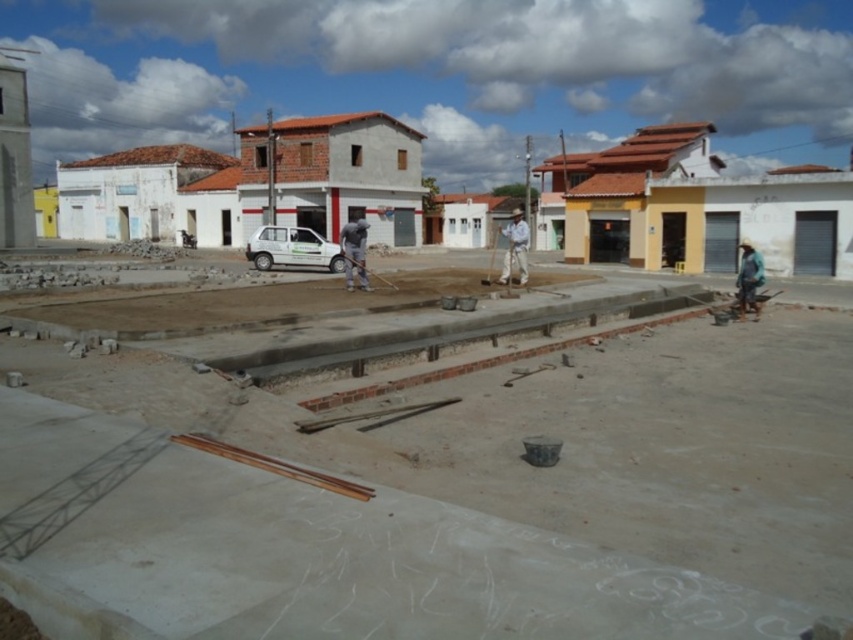
Question: Does gray matte shirt at center appear over white cotton shirt at center?

Choices:
 (A) yes
 (B) no

Answer: (B)

Question: Which point appears farthest from the camera in this image?

Choices:
 (A) (743, 317)
 (B) (523, 243)
 (C) (358, 244)

Answer: (B)

Question: Among these objects, which one is nearest to the camera?

Choices:
 (A) smooth concrete surface at center
 (B) white cotton shirt at center
 (C) gray matte shirt at center

Answer: (A)

Question: Does blue fabric shirt at right have a larger size compared to white cotton shirt at center?

Choices:
 (A) yes
 (B) no

Answer: (B)

Question: Considering the real-world distances, which object is farthest from the gray matte shirt at center?

Choices:
 (A) smooth concrete surface at center
 (B) blue fabric shirt at right
 (C) white cotton shirt at center

Answer: (B)

Question: Is gray matte shirt at center wider than blue fabric shirt at right?

Choices:
 (A) no
 (B) yes

Answer: (A)